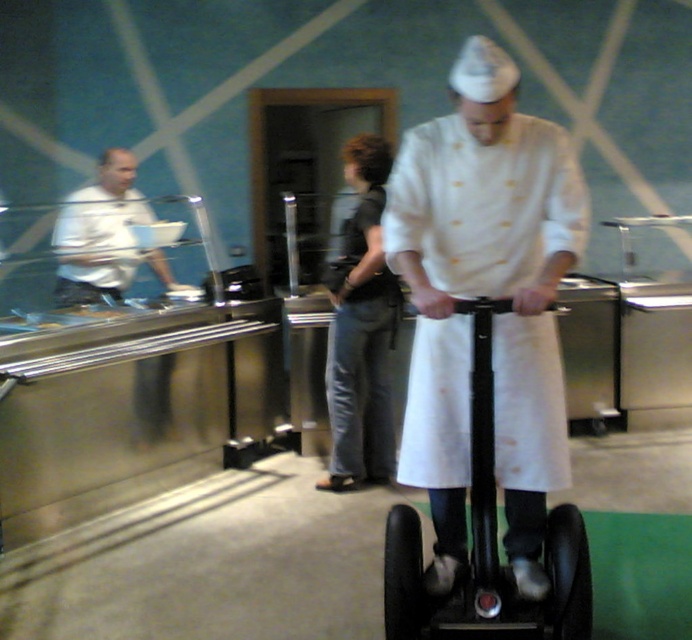
In the scene shown: You are a customer standing in the restaurant and see the black rubber scooter at center and the white matte shirt at left. Which object is taller?

The black rubber scooter at center is taller than the white matte shirt at left.

You are a customer in the restaurant and you see the black rubber scooter at center and the white matte shirt at left. Which object is closer to the floor?

The black rubber scooter at center is closer to the floor because it is below the white matte shirt at left.

You are a customer in the restaurant and you see the white matte chef coat at center and the white matte shirt at left. Which one is closer to the entrance of the restaurant?

The white matte shirt at left is closer to the entrance of the restaurant because it is positioned to the left of the white matte chef coat at center.